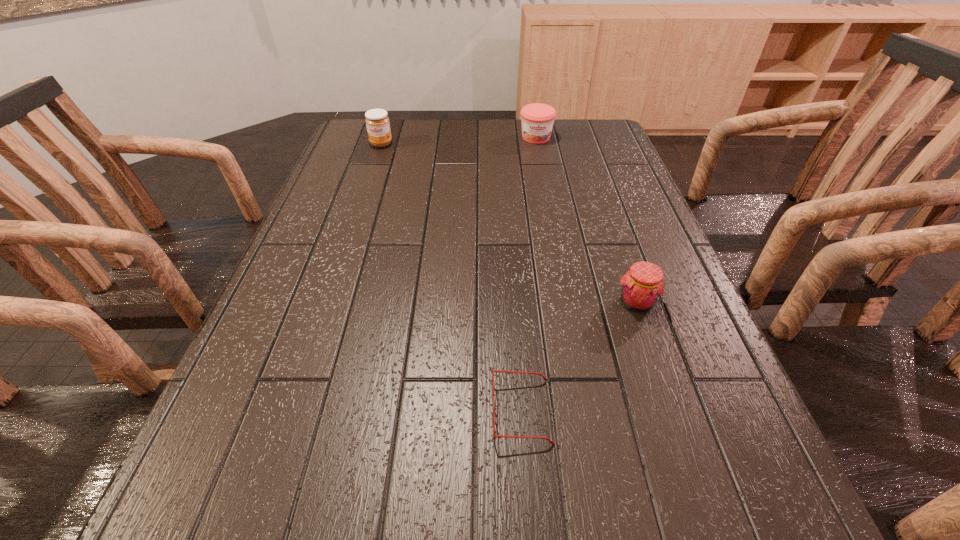
The height and width of the screenshot is (540, 960). I want to click on vacant region at the near right corner of the desktop, so click(742, 504).

What are the coordinates of `free space between the spectacles and the third object from left to right` in the screenshot? It's located at (529, 274).

I want to click on free space that is in between the leftmost jam and the nearest object, so 451,278.

You are a GUI agent. You are given a task and a screenshot of the screen. Output one action in this format:
    pyautogui.click(x=<x>, y=<y>)
    Task: Click on the vacant point located between the leftmost jam and the shortest object
    This screenshot has width=960, height=540.
    Given the screenshot: What is the action you would take?
    pyautogui.click(x=451, y=278)

The width and height of the screenshot is (960, 540). In order to click on free space between the second jam from left to right and the leftmost jam in this screenshot , I will do (459, 141).

Where is `free space between the rightmost object and the third object from right to left`? The image size is (960, 540). free space between the rightmost object and the third object from right to left is located at coordinates (579, 357).

Find the location of a particular element. Image resolution: width=960 pixels, height=540 pixels. vacant space that is in between the nearest jam and the shortest object is located at coordinates (579, 357).

I want to click on empty location between the rightmost jam and the leftmost object, so click(509, 223).

The width and height of the screenshot is (960, 540). Find the location of `empty location between the third object from right to left and the rightmost jam`. empty location between the third object from right to left and the rightmost jam is located at coordinates (579, 357).

At what (x,y) coordinates should I click in order to perform the action: click on free spot between the leftmost object and the second nearest object. Please return your answer as a coordinate pair (x, y). Image resolution: width=960 pixels, height=540 pixels. Looking at the image, I should click on (509, 223).